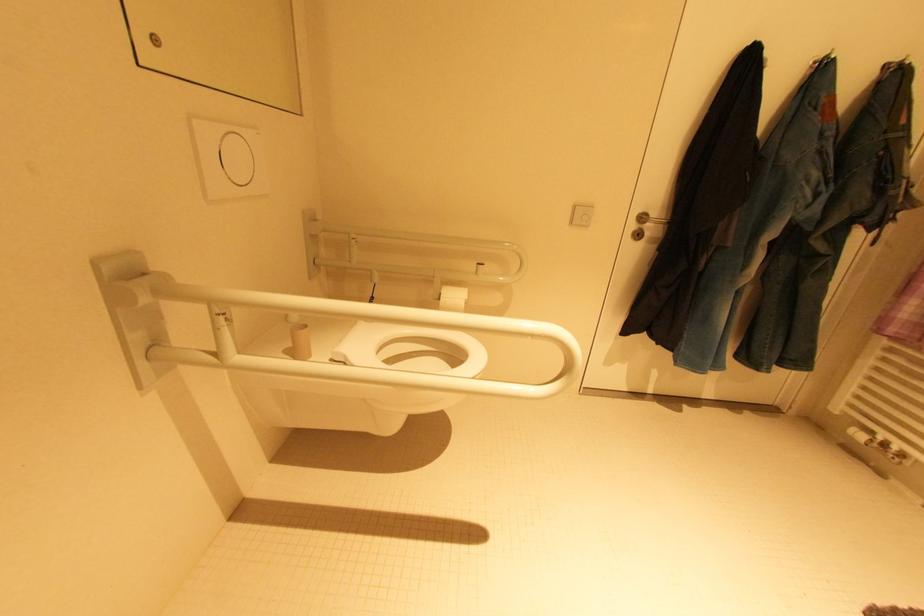
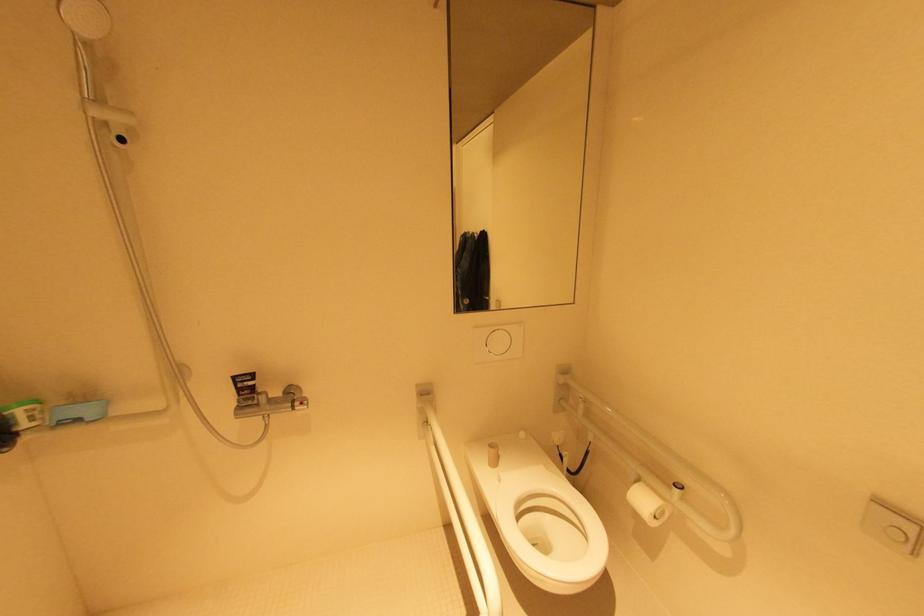
Question: The first image is from the beginning of the video and the second image is from the end. How did the camera likely rotate when shooting the video?

Choices:
 (A) Left
 (B) Right
 (C) Up
 (D) Down

Answer: (A)